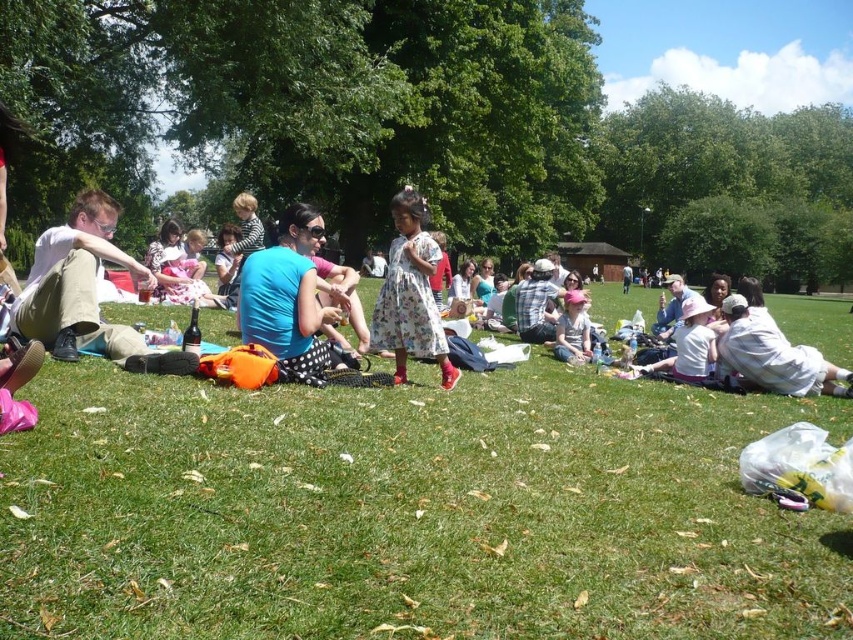
Question: Does floral dress at center appear on the right side of white cotton shirt at lower right?

Choices:
 (A) yes
 (B) no

Answer: (B)

Question: Which point appears farthest from the camera in this image?

Choices:
 (A) (442, 333)
 (B) (755, 364)
 (C) (463, 406)

Answer: (B)

Question: Can you confirm if green grass at center is positioned above matte khaki pants at left?

Choices:
 (A) yes
 (B) no

Answer: (B)

Question: Is green grass at center thinner than floral dress at center?

Choices:
 (A) yes
 (B) no

Answer: (B)

Question: Which point is farther from the camera taking this photo?

Choices:
 (A) (x=393, y=198)
 (B) (x=39, y=436)

Answer: (A)

Question: Which of these objects is positioned farthest from the green grass at center?

Choices:
 (A) floral dress at center
 (B) white cotton shirt at lower right
 (C) matte khaki pants at left

Answer: (C)